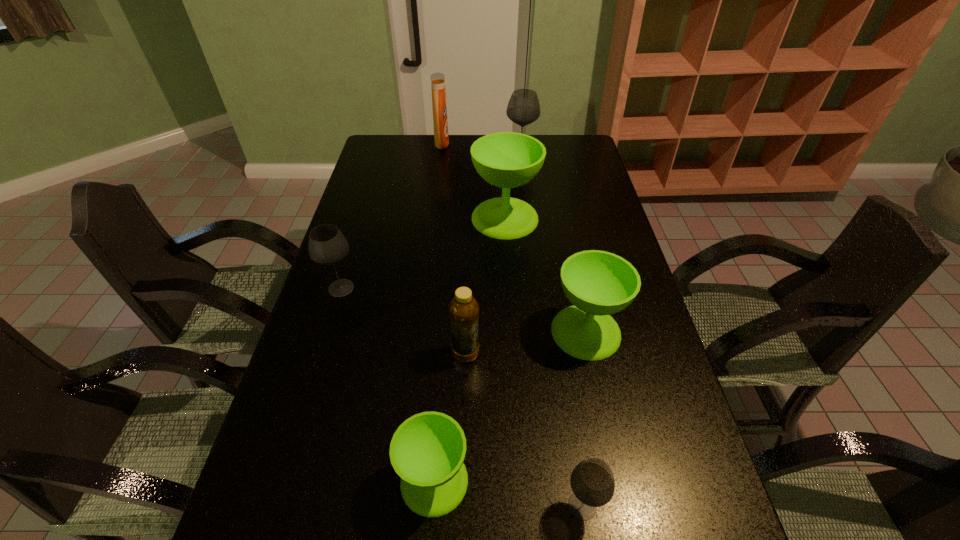
I want to click on detergent, so click(x=441, y=136).

Locate an element on the screen. the farthest gray wineglass is located at coordinates (523, 108).

You are a GUI agent. You are given a task and a screenshot of the screen. Output one action in this format:
    pyautogui.click(x=<x>, y=<y>)
    Task: Click on the biggest gray wineglass
    Image resolution: width=960 pixels, height=540 pixels.
    Given the screenshot: What is the action you would take?
    pyautogui.click(x=523, y=108)

Image resolution: width=960 pixels, height=540 pixels. Find the location of `the farthest green wineglass`. the farthest green wineglass is located at coordinates (506, 159).

I want to click on the sixth nearest object, so 506,159.

This screenshot has width=960, height=540. Find the location of `bottle`. bottle is located at coordinates (463, 309).

Identify the location of the fourth farthest wineglass. (598, 283).

At what (x,y) coordinates should I click in order to perform the action: click on the second biggest green wineglass. Please return your answer as a coordinate pair (x, y). This screenshot has height=540, width=960. Looking at the image, I should click on (598, 283).

Find the location of `the second farthest gray wineglass`. the second farthest gray wineglass is located at coordinates (327, 245).

Locate an element on the screen. the leftmost gray wineglass is located at coordinates (327, 245).